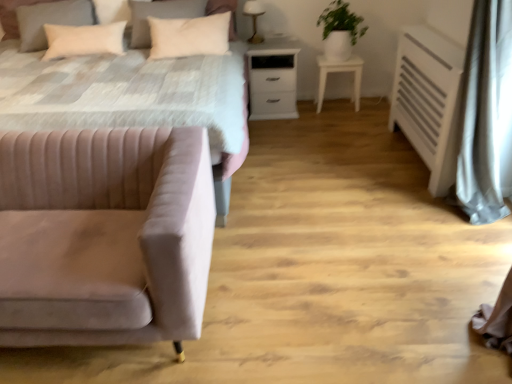
Question: Looking at the image, does white matte nightstand at center seem bigger or smaller compared to green matte plant at upper right?

Choices:
 (A) big
 (B) small

Answer: (A)

Question: From the image's perspective, is white matte nightstand at center positioned above or below green matte plant at upper right?

Choices:
 (A) below
 (B) above

Answer: (A)

Question: Which object is the farthest from the velvet pink bed at left?

Choices:
 (A) white glossy side table at center right
 (B) metallic gold table lamp at upper center
 (C) green matte plant at upper right
 (D) white matte nightstand at center
 (E) white soft pillow at upper left, which appears as the 3th pillow when viewed from the left

Answer: (B)

Question: Estimate the real-world distances between objects in this image. Which object is closer to the white glossy side table at center right?

Choices:
 (A) beige velvet pillow at upper left, arranged as the 1th pillow when viewed from the left
 (B) white soft pillow at upper left, which appears as the 3th pillow when viewed from the left
 (C) metallic gold table lamp at upper center
 (D) white sheer curtain at right
 (E) velvet pink couch at lower left

Answer: (C)